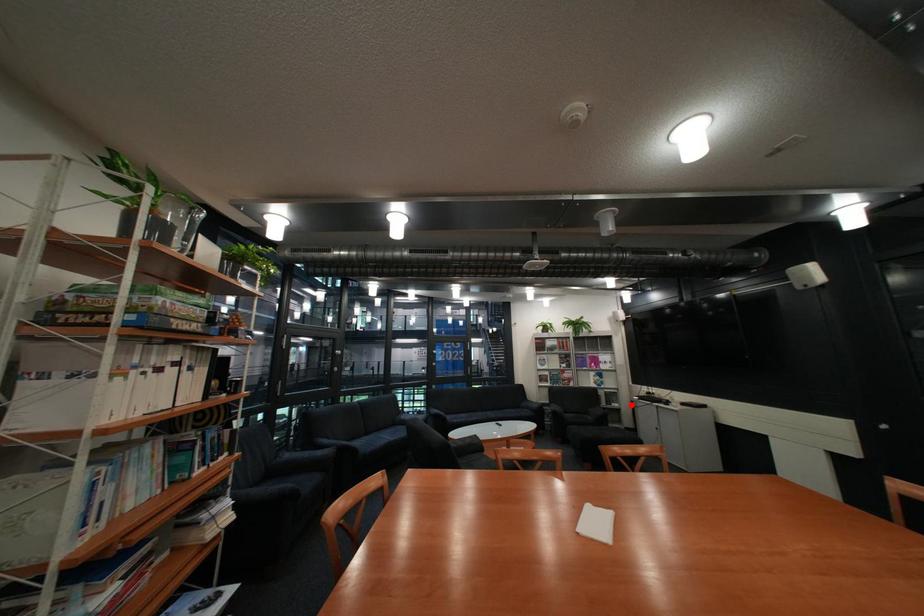
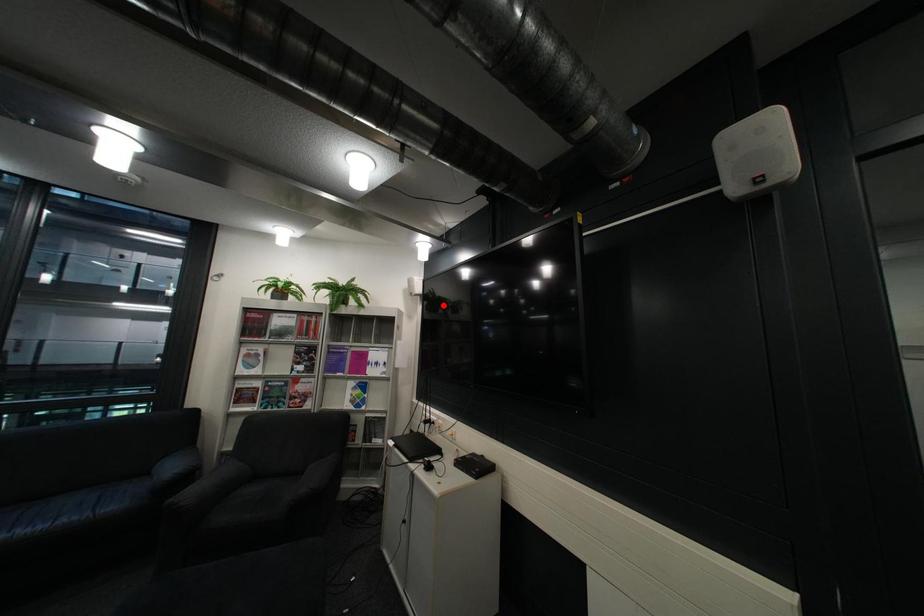
I am providing you with two images of the same scene from different viewpoints. A red point is marked on the first image and another point is marked on the second image. Do the highlighted points in image1 and image2 indicate the same real-world spot?

No